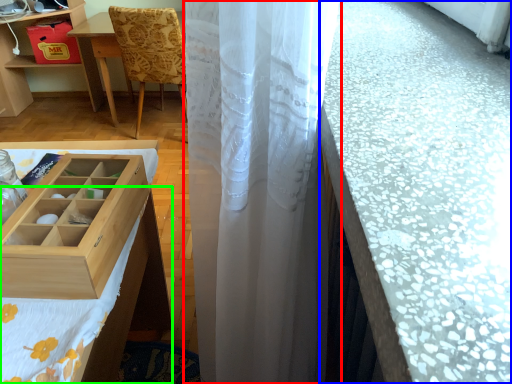
Question: Considering the real-world distances, which object is closest to curtain (highlighted by a red box)? counter top (highlighted by a blue box) or tablecloth (highlighted by a green box).

Choices:
 (A) counter top
 (B) tablecloth

Answer: (A)